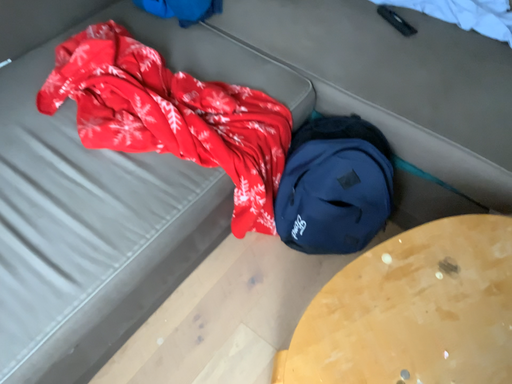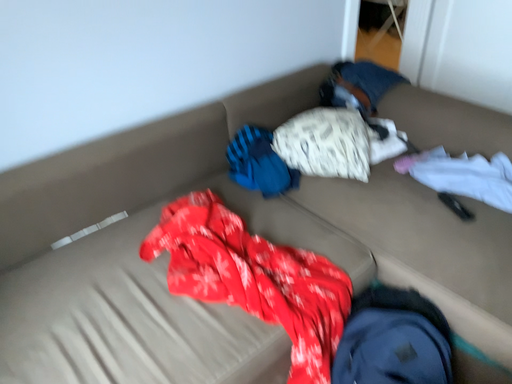
Question: How did the camera likely rotate when shooting the video?

Choices:
 (A) rotated upward
 (B) rotated downward

Answer: (A)